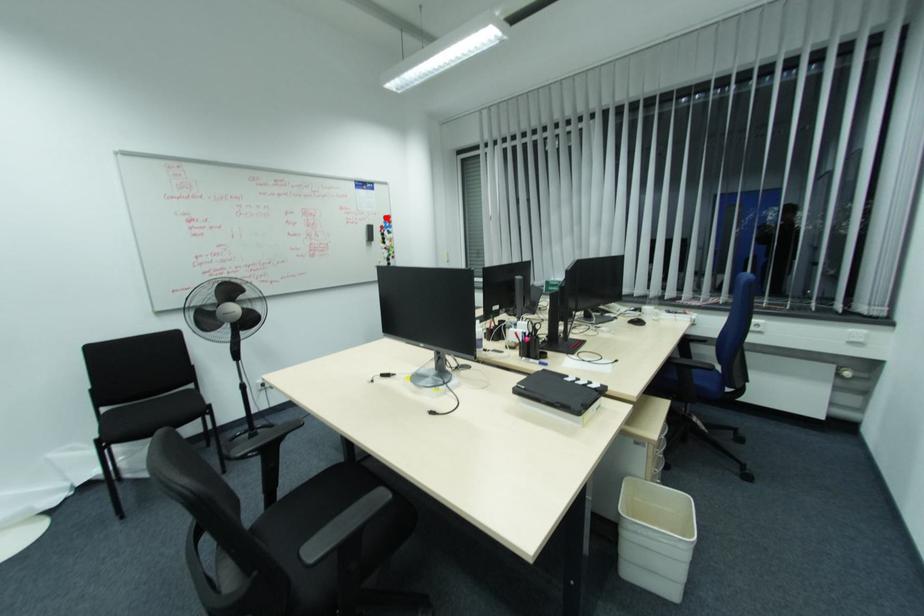
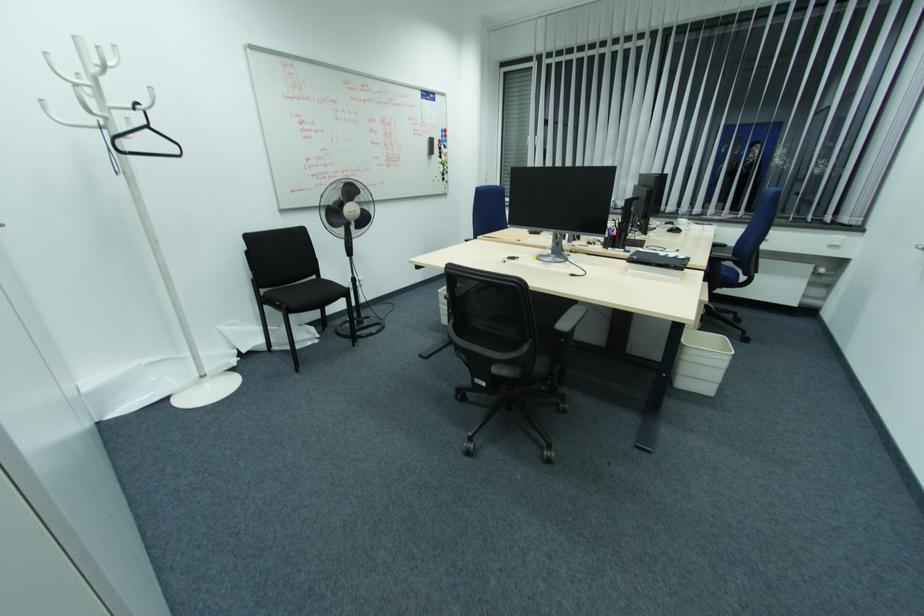
The point at the highlighted location is marked in the first image. Where is the corresponding point in the second image?

(444, 131)